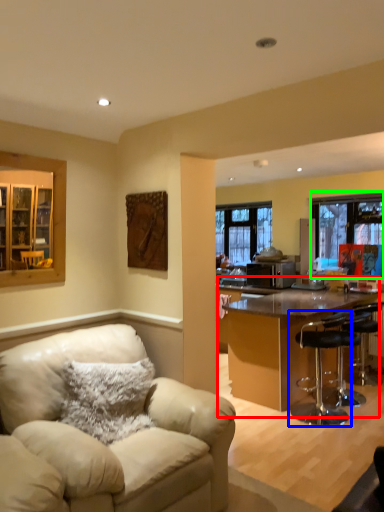
Question: Estimate the real-world distances between objects in this image. Which object is closer to kitchen & dining room table (highlighted by a red box), chair (highlighted by a blue box) or window (highlighted by a green box)?

Choices:
 (A) chair
 (B) window

Answer: (A)